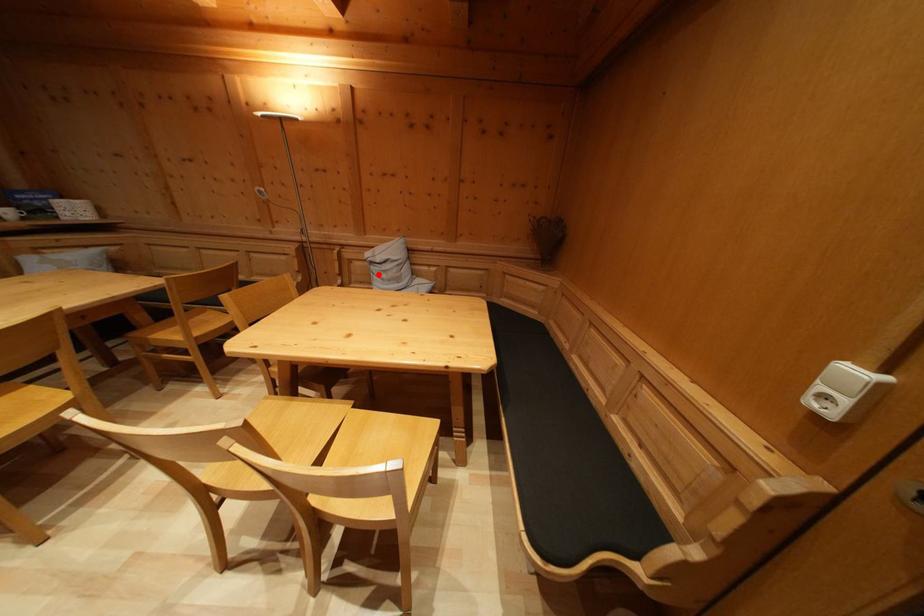
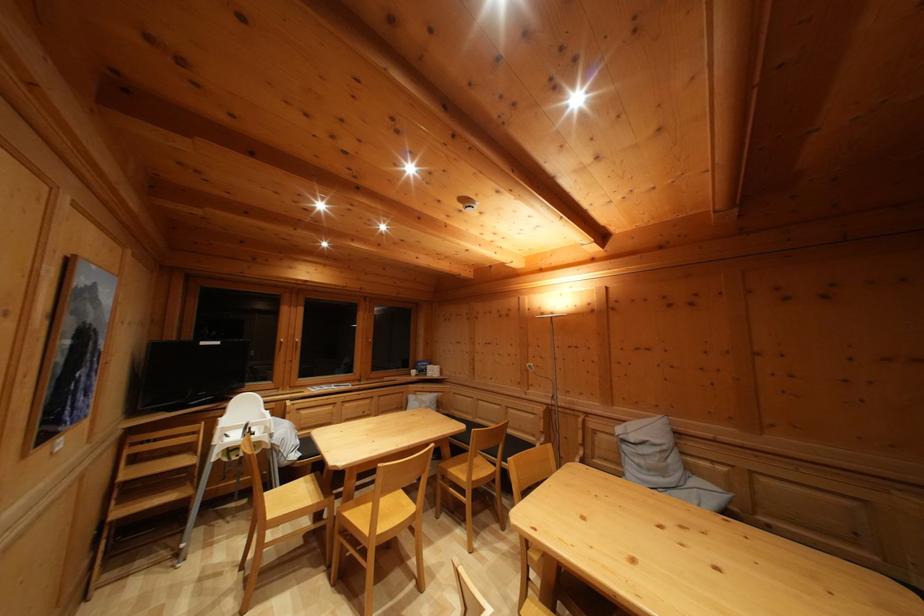
In the second image, find the point that corresponds to the highlighted location in the first image.

(629, 454)